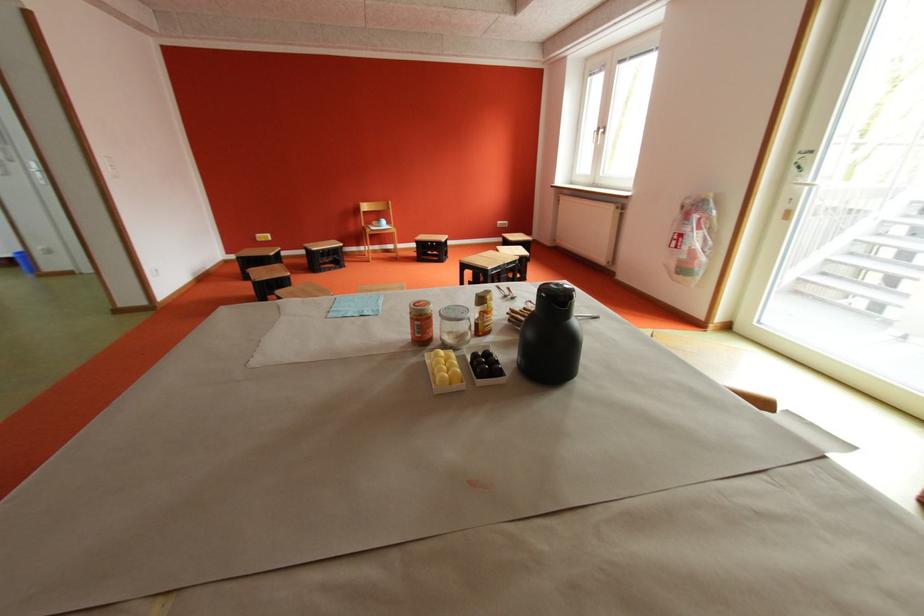
This screenshot has height=616, width=924. Find the location of `wooden clothespin`. wooden clothespin is located at coordinates (518, 314).